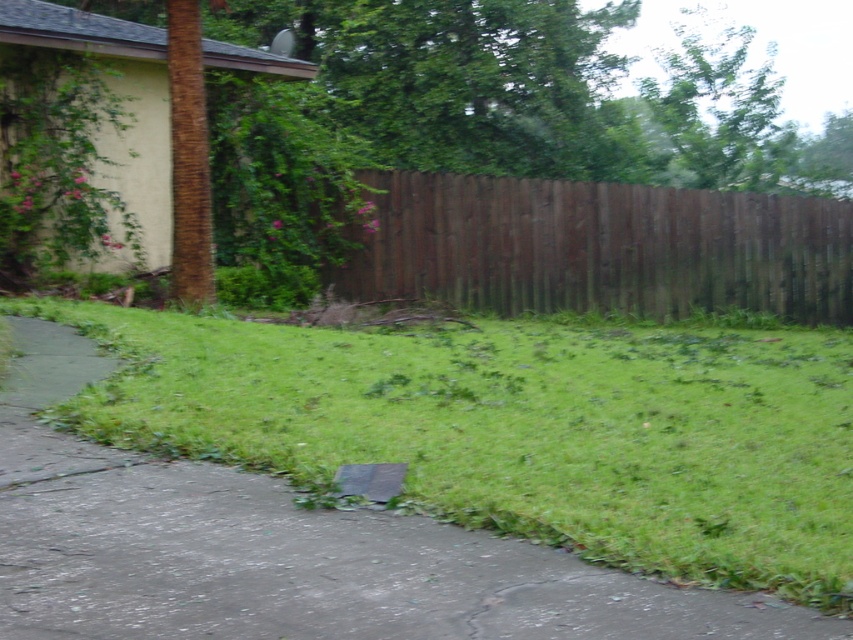
You are a gardener who wants to plant a new row of flowers along the edge of the driveway. You have two options for locations based on the available space. Which location would allow for a wider planting area between the green grass at lower left and the brown wood fence at center?

The brown wood fence at center has a wider space compared to the green grass at lower left, so planting along the brown wood fence at center would allow for a wider planting area.